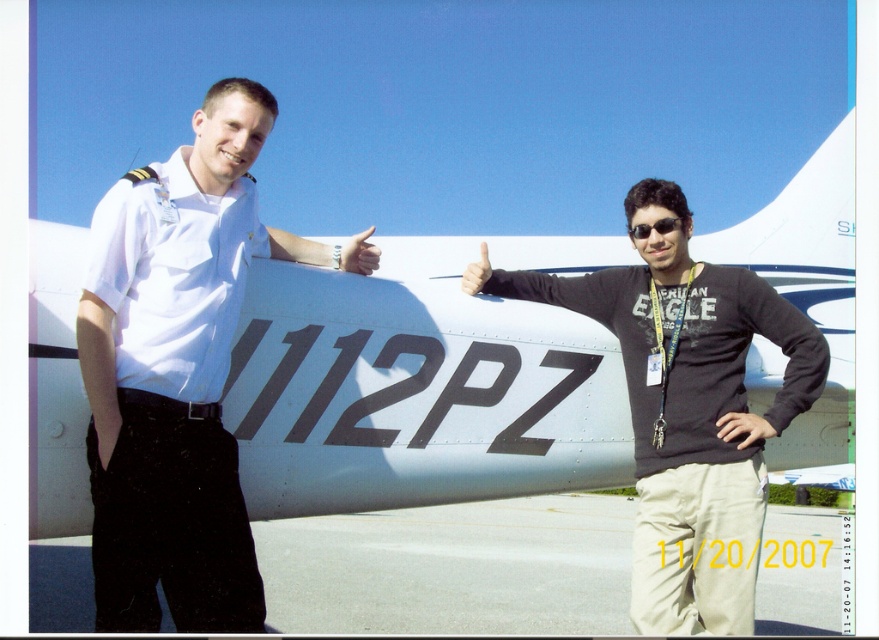
From the picture: You are a photographer trying to capture the registration number on the aircraft. Since the white metallic airplane at center and the matte skin at center are both in the frame, which object should you focus on to clearly see the registration number?

The white metallic airplane at center is in front of matte skin at center, so focusing on the white metallic airplane at center will allow you to clearly see the registration number displayed on its tail.

Where is the white metallic airplane at center located in the image?

The white metallic airplane at center is located at point (415, 388).

You are standing at the point with coordinates point [369,253] and want to walk to the point with coordinates point [418,323]. Which direction should you move in relation to the aircraft?

You should move forward towards the aircraft because point [418,323] is in front of point [369,253].